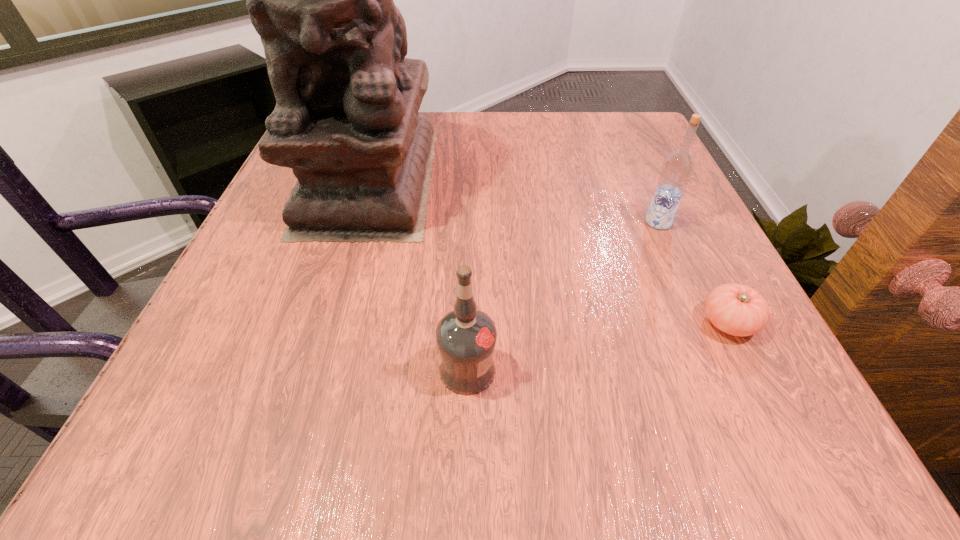
Find the location of a particular element. The width and height of the screenshot is (960, 540). vacant space located on the left of the shortest object is located at coordinates (567, 322).

You are a GUI agent. You are given a task and a screenshot of the screen. Output one action in this format:
    pyautogui.click(x=<x>, y=<y>)
    Task: Click on the object positioned at the far edge
    The height and width of the screenshot is (540, 960).
    Given the screenshot: What is the action you would take?
    pyautogui.click(x=346, y=120)

Locate an element on the screen. object that is at the left edge is located at coordinates (346, 120).

Identify the location of vodka situated at the right edge. The height and width of the screenshot is (540, 960). (677, 168).

Locate an element on the screen. tomato located in the right edge section of the desktop is located at coordinates (738, 310).

You are a GUI agent. You are given a task and a screenshot of the screen. Output one action in this format:
    pyautogui.click(x=<x>, y=<y>)
    Task: Click on the object that is at the far left corner
    
    Given the screenshot: What is the action you would take?
    pyautogui.click(x=346, y=120)

The width and height of the screenshot is (960, 540). I want to click on free space at the far edge of the desktop, so click(x=531, y=130).

Where is `free space at the near edge of the desktop`? The width and height of the screenshot is (960, 540). free space at the near edge of the desktop is located at coordinates (519, 421).

In order to click on free space at the left edge in this screenshot , I will do `click(261, 329)`.

Locate an element on the screen. The height and width of the screenshot is (540, 960). vacant space at the right edge of the desktop is located at coordinates (695, 231).